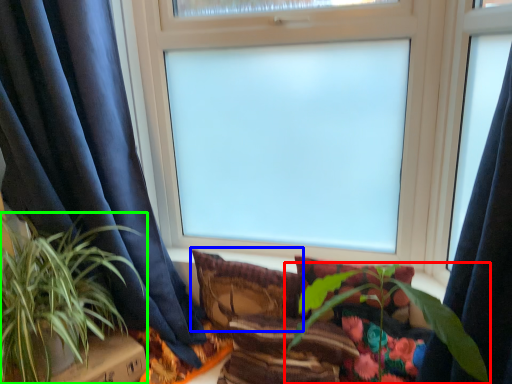
Question: Which object is the farthest from houseplant (highlighted by a red box)? Choose among these: pillow (highlighted by a blue box) or houseplant (highlighted by a green box).

Choices:
 (A) pillow
 (B) houseplant

Answer: (B)